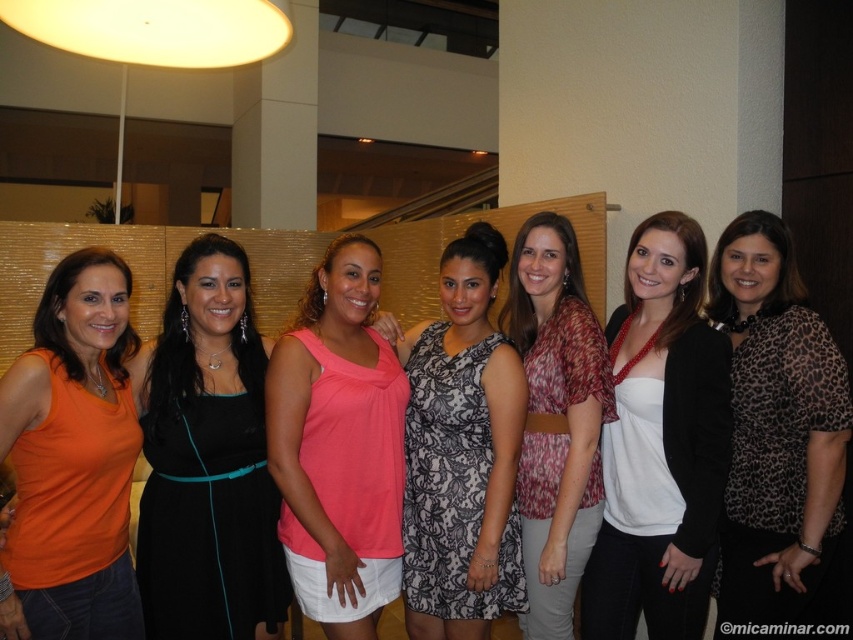
Which of these two, black satin dress at center or black lace dress at center, stands taller?

With more height is black lace dress at center.

Which is below, black satin dress at center or black lace dress at center?

black satin dress at center

The height and width of the screenshot is (640, 853). What do you see at coordinates (207, 460) in the screenshot? I see `black satin dress at center` at bounding box center [207, 460].

Identify the location of black satin dress at center. The image size is (853, 640). (207, 460).

Can you confirm if white matte dress at center is wider than black lace dress at center?

Incorrect, white matte dress at center's width does not surpass black lace dress at center's.

Can you confirm if white matte dress at center is positioned above black lace dress at center?

No.

Is point (688, 490) positioned after point (473, 403)?

No, (688, 490) is in front of (473, 403).

Locate an element on the screen. white matte dress at center is located at coordinates (660, 444).

Which of these two, black lace dress at center or printed fabric blouse at center, stands shorter?

Standing shorter between the two is black lace dress at center.

Is black lace dress at center below printed fabric blouse at center?

Yes.

This screenshot has height=640, width=853. Describe the element at coordinates (462, 452) in the screenshot. I see `black lace dress at center` at that location.

Locate an element on the screen. The height and width of the screenshot is (640, 853). black lace dress at center is located at coordinates (x=462, y=452).